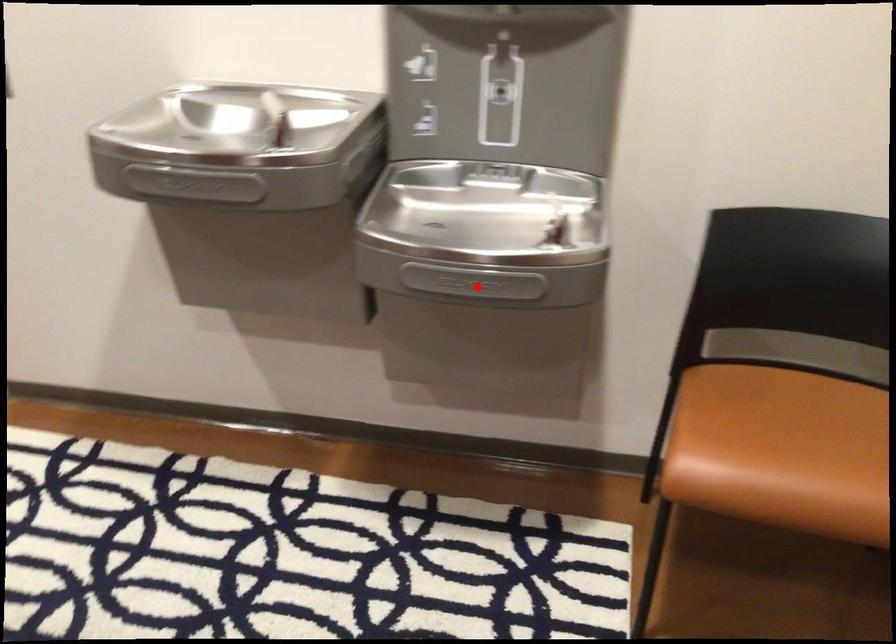
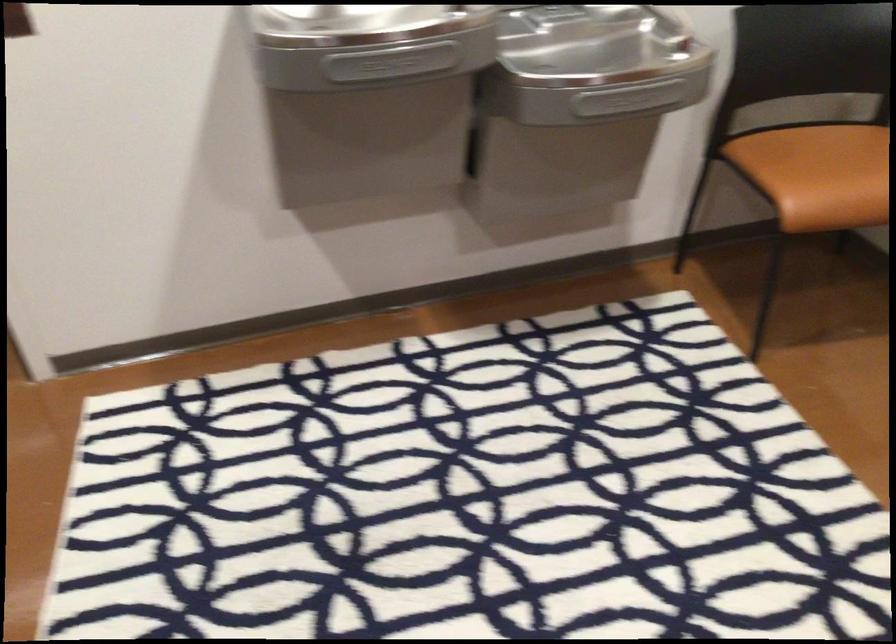
Question: I am providing you with two images of the same scene from different viewpoints. A red point is shown in image1. For the corresponding object point in image2, is it positioned nearer or farther from the camera?

Choices:
 (A) Nearer
 (B) Farther

Answer: (B)